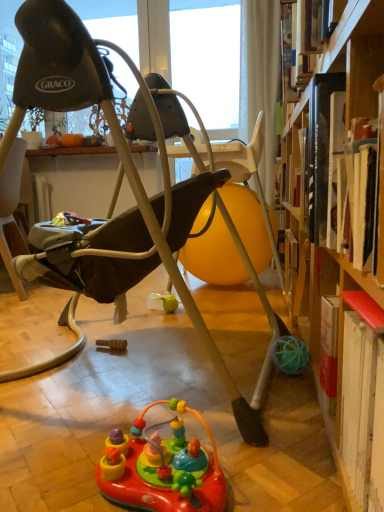
Locate an element on the screen. multicolored plastic toy at center is located at coordinates (162, 468).

The width and height of the screenshot is (384, 512). What do you see at coordinates (162, 468) in the screenshot?
I see `multicolored plastic toy at center` at bounding box center [162, 468].

What is the approximate height of multicolored plastic toy at center?

multicolored plastic toy at center is 4.67 inches tall.

You are a GUI agent. You are given a task and a screenshot of the screen. Output one action in this format:
    pyautogui.click(x=<x>, y=<y>)
    Task: Click on the matte black swing at center
    Image resolution: width=384 pixels, height=512 pixels.
    Given the screenshot: What is the action you would take?
    pyautogui.click(x=127, y=177)

What do you see at coordinates (127, 177) in the screenshot? I see `matte black swing at center` at bounding box center [127, 177].

Locate an element on the screen. This screenshot has width=384, height=512. multicolored plastic toy at center is located at coordinates 162,468.

Can you confirm if multicolored plastic toy at center is positioned to the left of matte black swing at center?

Incorrect, multicolored plastic toy at center is not on the left side of matte black swing at center.

Which object is further away from the camera, multicolored plastic toy at center or matte black swing at center?

Positioned behind is matte black swing at center.

Does point (167, 440) come behind point (161, 141)?

No, it is not.

From the image's perspective, which object appears higher, multicolored plastic toy at center or matte black swing at center?

matte black swing at center appears higher in the image.

From a real-world perspective, is multicolored plastic toy at center below matte black swing at center?

Yes, from a real-world perspective, multicolored plastic toy at center is below matte black swing at center.

Which object is thinner, multicolored plastic toy at center or matte black swing at center?

With smaller width is multicolored plastic toy at center.

In terms of height, does multicolored plastic toy at center look taller or shorter compared to matte black swing at center?

In the image, multicolored plastic toy at center appears to be shorter than matte black swing at center.

Between multicolored plastic toy at center and matte black swing at center, which one has smaller size?

With smaller size is multicolored plastic toy at center.

Which is correct: multicolored plastic toy at center is inside matte black swing at center, or outside of it?

multicolored plastic toy at center is located beyond the bounds of matte black swing at center.

Is multicolored plastic toy at center far away from matte black swing at center?

They are positioned close to each other.

In the scene shown: Is multicolored plastic toy at center oriented away from matte black swing at center?

No, matte black swing at center is not at the back of multicolored plastic toy at center.

Can you tell me how much multicolored plastic toy at center and matte black swing at center differ in facing direction?

The angle between the facing direction of multicolored plastic toy at center and the facing direction of matte black swing at center is 8.43 degrees.

Where is `toy below the matte black swing at center (from a real-world perspective)`? Image resolution: width=384 pixels, height=512 pixels. toy below the matte black swing at center (from a real-world perspective) is located at coordinates (162, 468).

Which object is positioned more to the left, matte black swing at center or multicolored plastic toy at center?

matte black swing at center.

Relative to multicolored plastic toy at center, is matte black swing at center in front or behind?

Visually, matte black swing at center is located behind multicolored plastic toy at center.

Is point (106, 255) closer to viewer compared to point (182, 492)?

No, it is behind (182, 492).

Looking at this image, from the image's perspective, relative to multicolored plastic toy at center, is matte black swing at center above or below?

From the image's perspective, matte black swing at center appears above multicolored plastic toy at center.

From a real-world perspective, is matte black swing at center above or below multicolored plastic toy at center?

In terms of real-world spatial position, matte black swing at center is above multicolored plastic toy at center.

Is matte black swing at center thinner than multicolored plastic toy at center?

No.

Is matte black swing at center shorter than multicolored plastic toy at center?

In fact, matte black swing at center may be taller than multicolored plastic toy at center.

Considering the relative sizes of matte black swing at center and multicolored plastic toy at center in the image provided, is matte black swing at center smaller than multicolored plastic toy at center?

Incorrect, matte black swing at center is not smaller in size than multicolored plastic toy at center.

Can multicolored plastic toy at center be found inside matte black swing at center?

No.

Is matte black swing at center directly adjacent to multicolored plastic toy at center?

No, matte black swing at center is not touching multicolored plastic toy at center.

Is matte black swing at center positioned with its back to multicolored plastic toy at center?

Result: No, matte black swing at center is not facing the opposite direction of multicolored plastic toy at center.

This screenshot has width=384, height=512. Identify the location of toy located underneath the matte black swing at center (from a real-world perspective). (162, 468).

You are a GUI agent. You are given a task and a screenshot of the screen. Output one action in this format:
    pyautogui.click(x=<x>, y=<y>)
    Task: Click on the chair behind the multicolored plastic toy at center
    This screenshot has width=384, height=512.
    Given the screenshot: What is the action you would take?
    pyautogui.click(x=127, y=177)

Locate an element on the screen. Image resolution: width=384 pixels, height=512 pixels. toy below the matte black swing at center (from the image's perspective) is located at coordinates (162, 468).